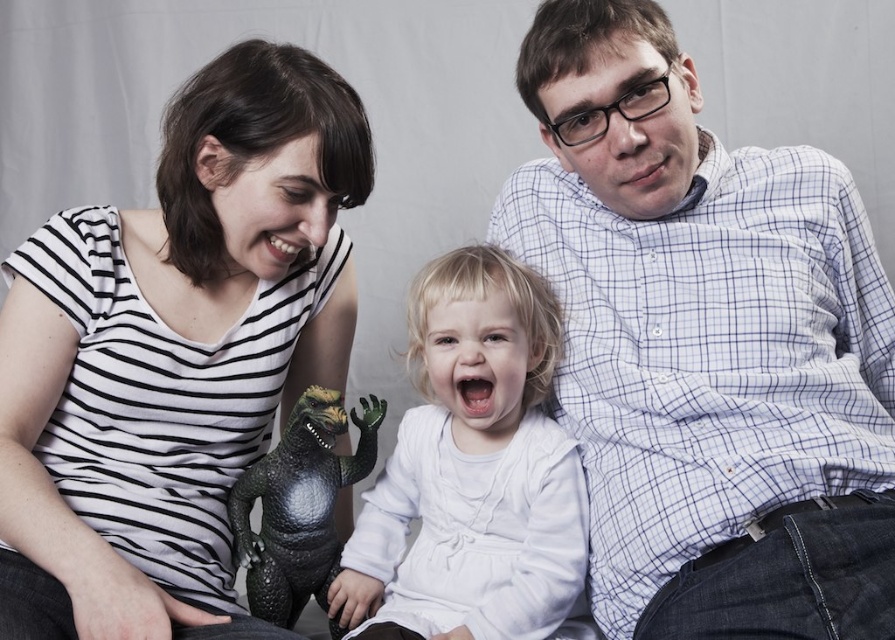
Who is more distant from viewer, [576,42] or [471,563]?

The point [471,563] is more distant.

Between white checkered shirt at upper right and white matte/soft fabric baby at center, which one has more height?

white checkered shirt at upper right is taller.

Which is behind, point (629, 333) or point (461, 248)?

The point (461, 248) is more distant.

This screenshot has height=640, width=895. I want to click on white checkered shirt at upper right, so click(x=706, y=346).

From the picture: Does matte black dinosaur toy at lower left have a greater height compared to white matte/soft fabric baby at center?

Yes.

Can you confirm if matte black dinosaur toy at lower left is positioned below white matte/soft fabric baby at center?

Actually, matte black dinosaur toy at lower left is above white matte/soft fabric baby at center.

Between point (151, 365) and point (415, 461), which one is positioned in front?

Positioned in front is point (151, 365).

At what (x,y) coordinates should I click in order to perform the action: click on matte black dinosaur toy at lower left. Please return your answer as a coordinate pair (x, y). The width and height of the screenshot is (895, 640). Looking at the image, I should click on (175, 353).

Can you confirm if white checkered shirt at upper right is positioned below matte black dinosaur toy at lower left?

Incorrect, white checkered shirt at upper right is not positioned below matte black dinosaur toy at lower left.

At what (x,y) coordinates should I click in order to perform the action: click on white checkered shirt at upper right. Please return your answer as a coordinate pair (x, y). Looking at the image, I should click on coord(706,346).